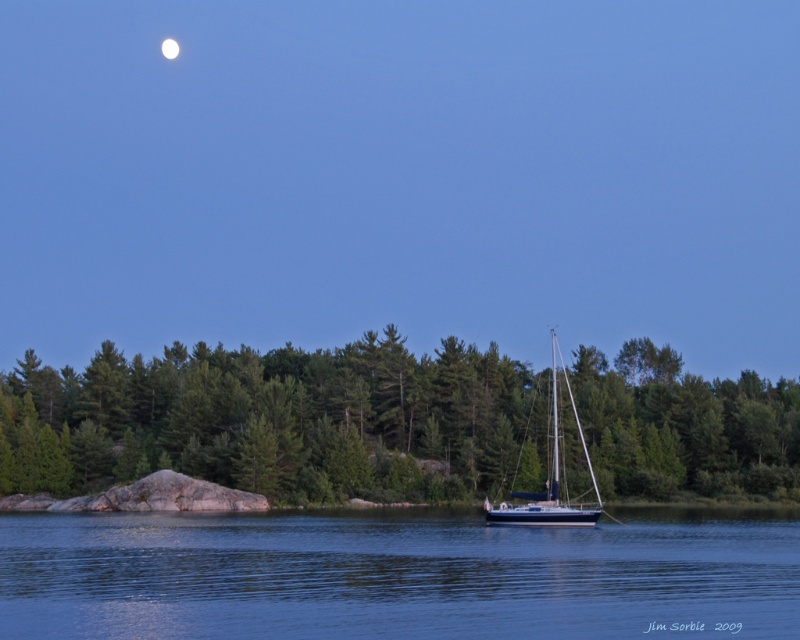
Question: Is blue water at center further to the viewer compared to bright white sphere at upper center?

Choices:
 (A) yes
 (B) no

Answer: (B)

Question: Which object appears closest to the camera in this image?

Choices:
 (A) blue water at center
 (B) green matte tree at lower left

Answer: (A)

Question: Observing the image, what is the correct spatial positioning of blue water at center in reference to bright white sphere at upper center?

Choices:
 (A) left
 (B) right

Answer: (B)

Question: Which object appears farthest from the camera in this image?

Choices:
 (A) blue water at center
 (B) bright white sphere at upper center
 (C) green matte tree at lower left
 (D) blue glossy sailboat at center

Answer: (B)

Question: Can you confirm if green matte tree at lower left is positioned to the left of blue water at center?

Choices:
 (A) no
 (B) yes

Answer: (B)

Question: Estimate the real-world distances between objects in this image. Which object is closer to the blue water at center?

Choices:
 (A) blue glossy sailboat at center
 (B) bright white sphere at upper center

Answer: (A)